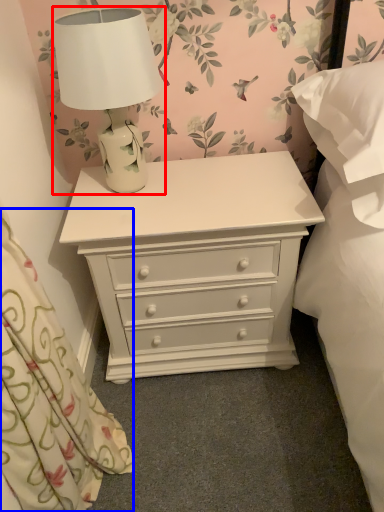
Question: Which point is further to the camera, lamp (highlighted by a red box) or curtain (highlighted by a blue box)?

Choices:
 (A) lamp
 (B) curtain

Answer: (A)